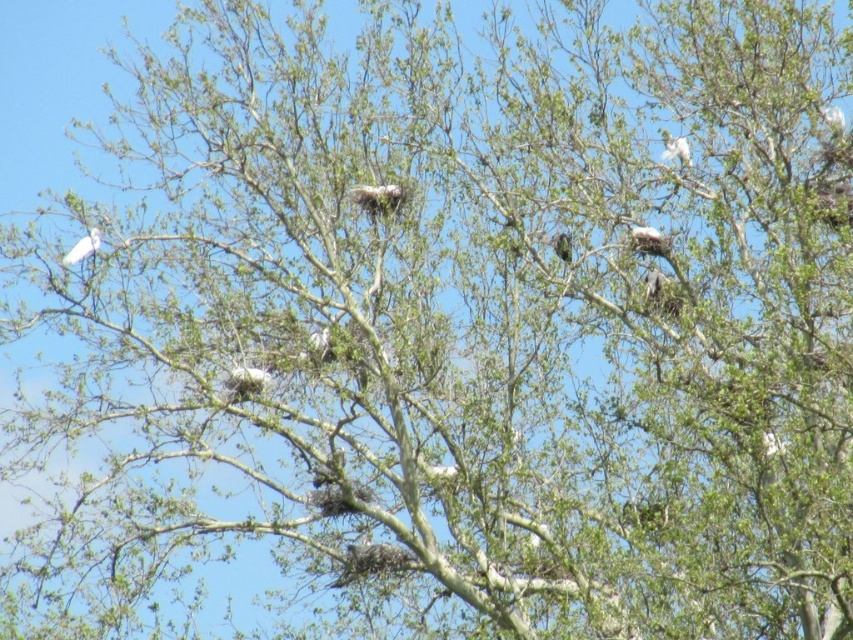
Question: From the image, what is the correct spatial relationship of white fluffy nest at upper center in relation to green textured bird at center?

Choices:
 (A) above
 (B) below

Answer: (A)

Question: Is white fluffy nest at upper center smaller than white feathered bird at upper left?

Choices:
 (A) no
 (B) yes

Answer: (B)

Question: Can you confirm if white feathered bird at upper left is thinner than green textured bird at center?

Choices:
 (A) no
 (B) yes

Answer: (A)

Question: Which is farther from the white fluffy nest at upper right?

Choices:
 (A) green textured bird at center
 (B) white fluffy bird at upper right
 (C) white fluffy nest at upper center
 (D) white fluffy nest at center

Answer: (D)

Question: Which point is closer to the camera?

Choices:
 (A) white matte bird at center
 (B) white fluffy nest at upper center

Answer: (A)

Question: Which object is the farthest from the white fluffy nest at upper right?

Choices:
 (A) white fluffy nest at center
 (B) white fluffy nest at upper center
 (C) white matte bird at center
 (D) white fluffy bird at upper right

Answer: (A)